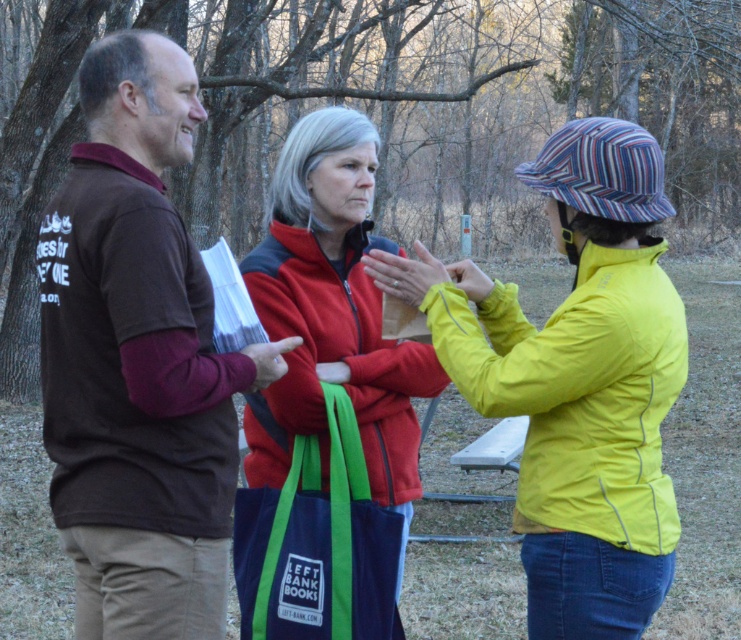
Question: Is yellow/waterproof jacket at right positioned in front of red fleece jacket at center?

Choices:
 (A) no
 (B) yes

Answer: (B)

Question: Which object appears closest to the camera in this image?

Choices:
 (A) yellow/waterproof jacket at right
 (B) red fleece jacket at center
 (C) brown cotton shirt at left

Answer: (A)

Question: Which is nearer to the red fleece jacket at center?

Choices:
 (A) brown cotton shirt at left
 (B) yellow/waterproof jacket at right

Answer: (A)

Question: Which object is farther from the camera taking this photo?

Choices:
 (A) brown cotton shirt at left
 (B) red fleece jacket at center
 (C) yellow/waterproof jacket at right

Answer: (B)

Question: Is brown cotton shirt at left to the left of yellow/waterproof jacket at right from the viewer's perspective?

Choices:
 (A) no
 (B) yes

Answer: (B)

Question: Can you confirm if yellow/waterproof jacket at right is thinner than red fleece jacket at center?

Choices:
 (A) no
 (B) yes

Answer: (A)